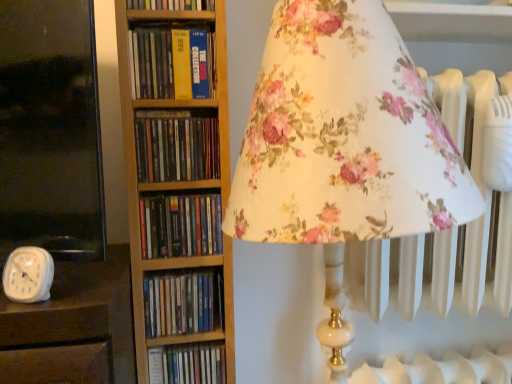
Question: Is blue hardcover book at center, which ranks as the fifth book in top-to-bottom order, bigger than hardcover book at center, which ranks as the third book in bottom-to-top order?

Choices:
 (A) yes
 (B) no

Answer: (A)

Question: From a real-world perspective, is blue hardcover book at center, positioned as the 2th book in bottom-to-top order, over hardcover book at center, which ranks as the third book in bottom-to-top order?

Choices:
 (A) no
 (B) yes

Answer: (A)

Question: Can you confirm if blue hardcover book at center, which ranks as the fifth book in top-to-bottom order, is smaller than hardcover book at center, placed as the 4th book when sorted from top to bottom?

Choices:
 (A) no
 (B) yes

Answer: (A)

Question: Is blue hardcover book at center, which ranks as the fifth book in top-to-bottom order, to the right of hardcover book at center, placed as the 4th book when sorted from top to bottom, from the viewer's perspective?

Choices:
 (A) yes
 (B) no

Answer: (A)

Question: Does blue hardcover book at center, positioned as the 2th book in bottom-to-top order, have a greater width compared to hardcover book at center, which ranks as the third book in bottom-to-top order?

Choices:
 (A) yes
 (B) no

Answer: (A)

Question: Considering the positions of blue hardcover book at center, positioned as the 2th book in bottom-to-top order, and hardcover books at center, the 3th book viewed from the top, in the image, is blue hardcover book at center, positioned as the 2th book in bottom-to-top order, taller or shorter than hardcover books at center, the 3th book viewed from the top,?

Choices:
 (A) short
 (B) tall

Answer: (A)

Question: Choose the correct answer: Is blue hardcover book at center, positioned as the 2th book in bottom-to-top order, inside hardcover books at center, the 3th book viewed from the top, or outside it?

Choices:
 (A) inside
 (B) outside

Answer: (B)

Question: Looking at their shapes, would you say blue hardcover book at center, positioned as the 2th book in bottom-to-top order, is wider or thinner than hardcover books at center, the fourth book ordered from the bottom?

Choices:
 (A) thin
 (B) wide

Answer: (A)

Question: In terms of size, does blue hardcover book at center, which ranks as the fifth book in top-to-bottom order, appear bigger or smaller than hardcover books at center, the 3th book viewed from the top?

Choices:
 (A) small
 (B) big

Answer: (A)

Question: Does point (24, 278) appear closer or farther from the camera than point (165, 354)?

Choices:
 (A) farther
 (B) closer

Answer: (B)

Question: Considering the positions of white plastic clock at lower left and hardcover book at center, marked as the 6th book in a top-to-bottom arrangement, in the image, is white plastic clock at lower left bigger or smaller than hardcover book at center, marked as the 6th book in a top-to-bottom arrangement,?

Choices:
 (A) small
 (B) big

Answer: (A)

Question: Considering the positions of white plastic clock at lower left and hardcover book at center, acting as the first book starting from the bottom, in the image, is white plastic clock at lower left taller or shorter than hardcover book at center, acting as the first book starting from the bottom,?

Choices:
 (A) short
 (B) tall

Answer: (A)

Question: From the image's perspective, is white plastic clock at lower left located above or below hardcover book at center, marked as the 6th book in a top-to-bottom arrangement?

Choices:
 (A) above
 (B) below

Answer: (A)

Question: Is point (188, 39) positioned closer to the camera than point (161, 231)?

Choices:
 (A) closer
 (B) farther

Answer: (A)

Question: Considering the positions of yellow hardcover book at center, which appears as the second book when viewed from the top, and hardcover book at center, which ranks as the third book in bottom-to-top order, in the image, is yellow hardcover book at center, which appears as the second book when viewed from the top, wider or thinner than hardcover book at center, which ranks as the third book in bottom-to-top order,?

Choices:
 (A) wide
 (B) thin

Answer: (A)